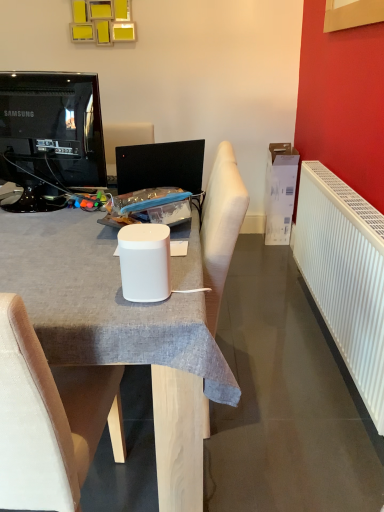
Image resolution: width=384 pixels, height=512 pixels. I want to click on vacant area situated below black glossy television at upper left (from a real-world perspective), so click(x=41, y=202).